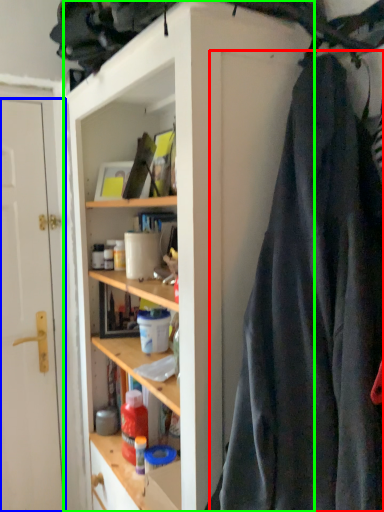
Question: Considering the real-world distances, which object is farthest from clothing (highlighted by a red box)? door (highlighted by a blue box) or cabinetry (highlighted by a green box)?

Choices:
 (A) door
 (B) cabinetry

Answer: (A)